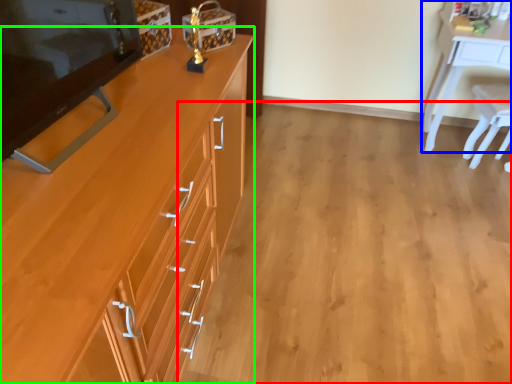
Question: Which object is positioned farthest from plain (highlighted by a red box)? Select from desk (highlighted by a blue box) and cabinetry (highlighted by a green box).

Choices:
 (A) desk
 (B) cabinetry

Answer: (A)